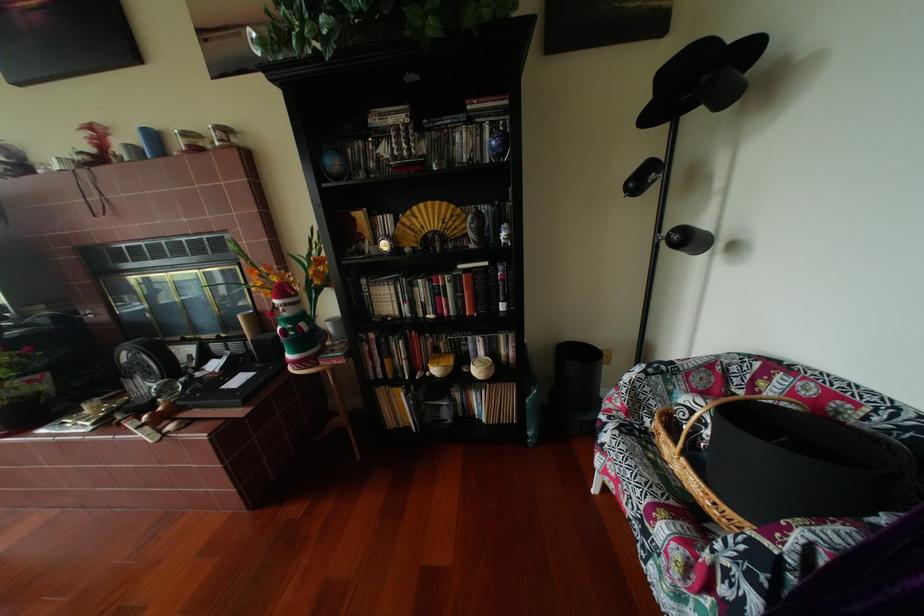
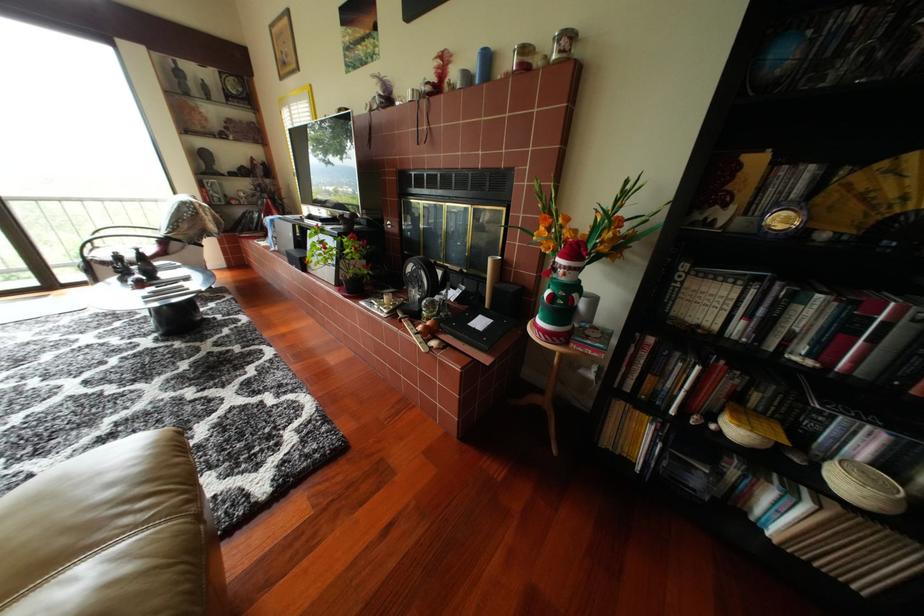
Question: The camera is either moving clockwise (left) or counter-clockwise (right) around the object. The first image is from the beginning of the video and the second image is from the end. Is the camera moving left or right when shooting the video?

Choices:
 (A) Left
 (B) Right

Answer: (B)